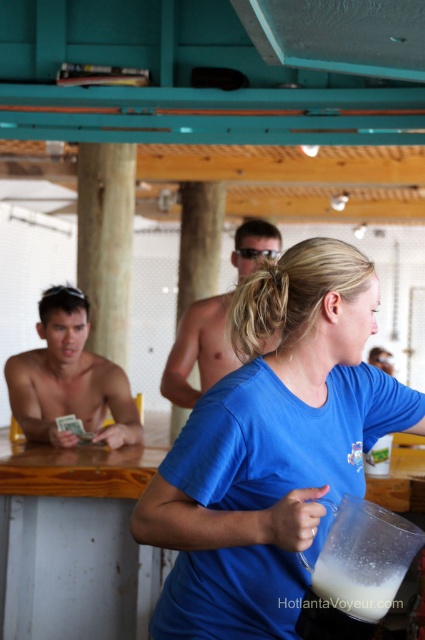
You are standing in the bar and need to locate the blue fabric shirt at center. According to the coordinates provided, where exactly is it positioned?

The blue fabric shirt at center is located at coordinates point [272,448].

What object is located at the coordinate point (68, 380) in the image?

The shiny skin torso at left is located at the coordinate point (68, 380).